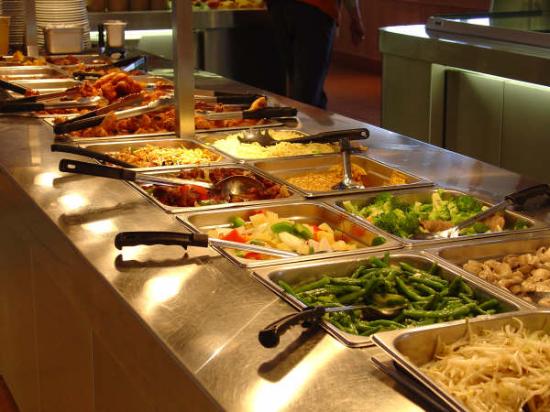
Locate an element on the screen. This screenshot has width=550, height=412. spoon is located at coordinates (329, 309), (165, 238), (126, 165), (348, 130).